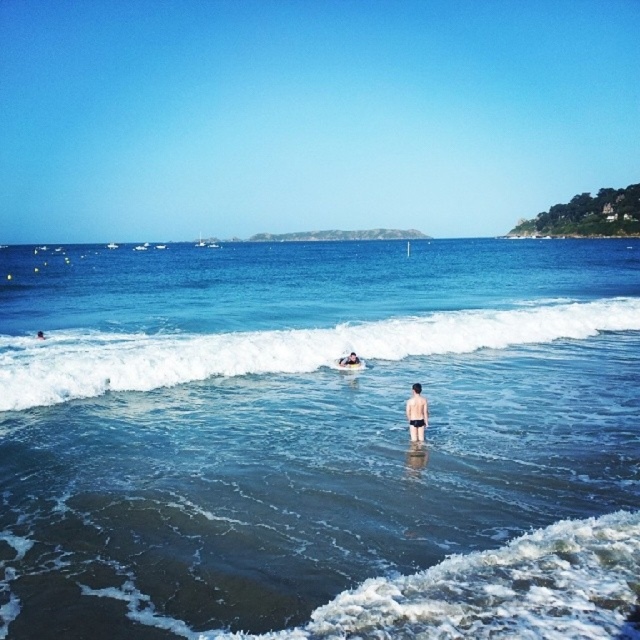
Question: Among these points, which one is nearest to the camera?

Choices:
 (A) (192, 369)
 (B) (134, 620)

Answer: (B)

Question: Is blue clear water at center closer to the viewer compared to skinny man at lower center?

Choices:
 (A) no
 (B) yes

Answer: (B)

Question: Which object is positioned farthest from the black matte shorts at center?

Choices:
 (A) blue clear water at center
 (B) smooth skin person at center
 (C) white foamy wave at center

Answer: (A)

Question: Is the position of white foamy wave at center more distant than that of black matte shorts at center?

Choices:
 (A) no
 (B) yes

Answer: (B)

Question: Is black matte shorts at center smaller than skinny man at lower center?

Choices:
 (A) no
 (B) yes

Answer: (A)

Question: Estimate the real-world distances between objects in this image. Which object is farther from the white foamy wave at center?

Choices:
 (A) blue clear water at center
 (B) skinny man at lower center

Answer: (A)